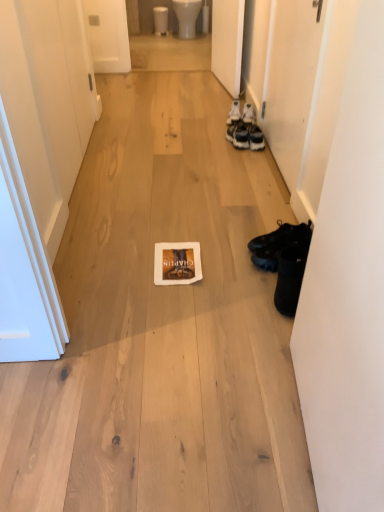
Question: Should I look upward or downward to see white leather sneakers at right, which ranks as the 1th footwear in top-to-bottom order?

Choices:
 (A) down
 (B) up

Answer: (B)

Question: Considering the relative positions of white leather sneakers at right, which ranks as the 1th footwear in top-to-bottom order, and white matte door at right, acting as the third door starting from the left, in the image provided, is white leather sneakers at right, which ranks as the 1th footwear in top-to-bottom order, behind white matte door at right, acting as the third door starting from the left,?

Choices:
 (A) no
 (B) yes

Answer: (B)

Question: Is white matte door at right, marked as the first door in a right-to-left arrangement, at the back of white leather sneakers at right, the third footwear in the front-to-back sequence?

Choices:
 (A) no
 (B) yes

Answer: (A)

Question: Could you tell me if white leather sneakers at right, the 1th footwear from the back, is facing white matte door at right, acting as the third door starting from the left?

Choices:
 (A) no
 (B) yes

Answer: (A)

Question: Is white leather sneakers at right, which ranks as the 1th footwear in top-to-bottom order, in front of white matte door at right, marked as the first door in a right-to-left arrangement?

Choices:
 (A) yes
 (B) no

Answer: (B)

Question: Considering the relative sizes of white leather sneakers at right, the 1th footwear from the back, and white matte door at right, acting as the third door starting from the left, in the image provided, is white leather sneakers at right, the 1th footwear from the back, bigger than white matte door at right, acting as the third door starting from the left,?

Choices:
 (A) no
 (B) yes

Answer: (A)

Question: Can you confirm if white leather sneakers at right, the 1th footwear from the back, is wider than white matte door at right, marked as the first door in a right-to-left arrangement?

Choices:
 (A) no
 (B) yes

Answer: (B)

Question: Is black leather shoes at right, which ranks as the 2th footwear in front-to-back order, with white matte door at upper right, marked as the 2th door in a left-to-right arrangement?

Choices:
 (A) yes
 (B) no

Answer: (B)

Question: Considering the relative positions of black leather shoes at right, which ranks as the 2th footwear in front-to-back order, and white matte door at upper right, marked as the 2th door in a right-to-left arrangement, in the image provided, is black leather shoes at right, which ranks as the 2th footwear in front-to-back order, behind white matte door at upper right, marked as the 2th door in a right-to-left arrangement,?

Choices:
 (A) yes
 (B) no

Answer: (B)

Question: Considering the relative positions of black leather shoes at right, acting as the 2th footwear starting from the top, and white matte door at upper right, marked as the 2th door in a left-to-right arrangement, in the image provided, is black leather shoes at right, acting as the 2th footwear starting from the top, to the left of white matte door at upper right, marked as the 2th door in a left-to-right arrangement, from the viewer's perspective?

Choices:
 (A) yes
 (B) no

Answer: (B)

Question: Considering the relative sizes of black leather shoes at right, acting as the 2th footwear starting from the bottom, and white matte door at upper right, marked as the 2th door in a left-to-right arrangement, in the image provided, is black leather shoes at right, acting as the 2th footwear starting from the bottom, thinner than white matte door at upper right, marked as the 2th door in a left-to-right arrangement,?

Choices:
 (A) yes
 (B) no

Answer: (B)

Question: Is black leather shoes at right, acting as the 2th footwear starting from the top, not close to white matte door at upper right, marked as the 2th door in a right-to-left arrangement?

Choices:
 (A) no
 (B) yes

Answer: (B)

Question: From the image's perspective, is black leather shoes at right, acting as the 2th footwear starting from the bottom, beneath white matte door at upper right, marked as the 2th door in a left-to-right arrangement?

Choices:
 (A) no
 (B) yes

Answer: (B)

Question: Does black leather shoes at lower right, placed as the third footwear when sorted from back to front, have a greater width compared to black leather shoes at right, the 2th footwear from the back?

Choices:
 (A) yes
 (B) no

Answer: (B)